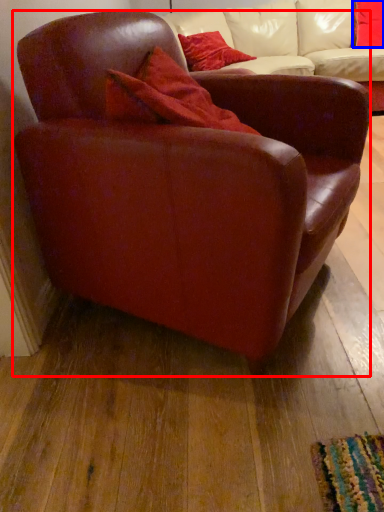
Question: Which object appears closest to the camera in this image, chair (highlighted by a red box) or pillow (highlighted by a blue box)?

Choices:
 (A) chair
 (B) pillow

Answer: (A)